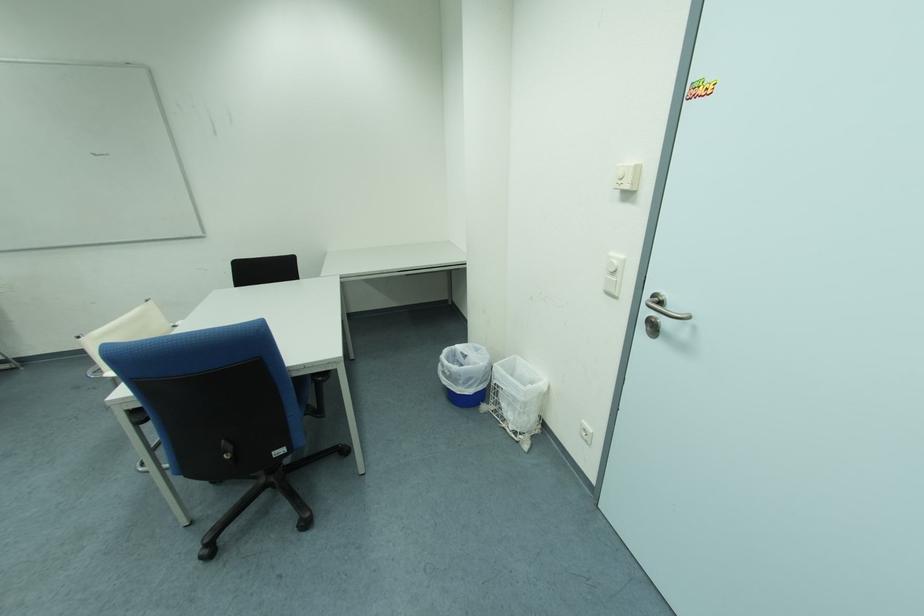
Where would you lift the blue trash can? Please return your answer as a coordinate pair (x, y).

(465, 373)